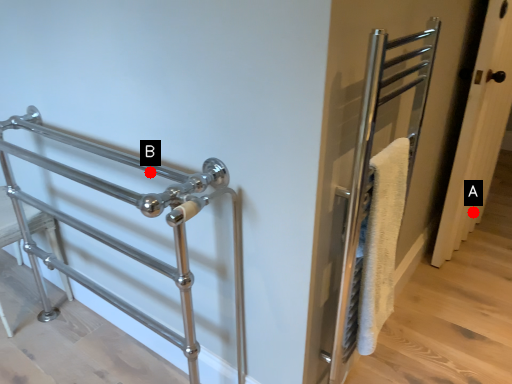
Question: Two points are circled on the image, labeled by A and B beside each circle. Which point is closer to the camera taking this photo?

Choices:
 (A) A is closer
 (B) B is closer

Answer: (B)